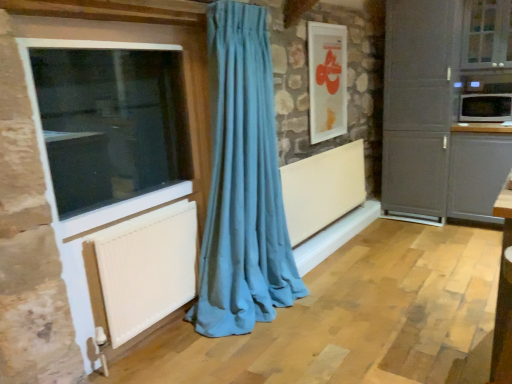
Find the location of `vacant space situated above white glossy picture frame at upper center (from a real-world perspective)`. vacant space situated above white glossy picture frame at upper center (from a real-world perspective) is located at coordinates (325, 23).